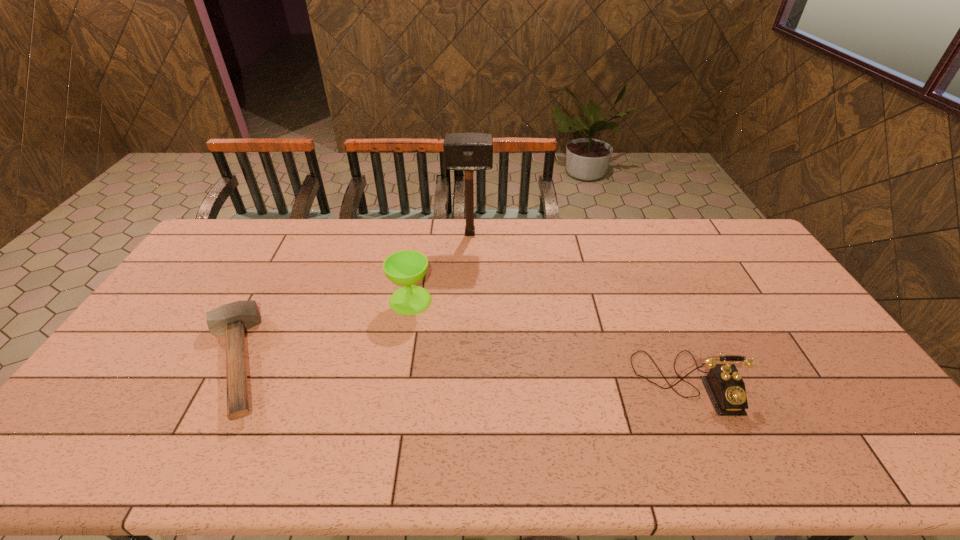
Image resolution: width=960 pixels, height=540 pixels. In order to click on the right mallet in this screenshot , I will do `click(468, 152)`.

Find the location of a particular element. The width and height of the screenshot is (960, 540). the second object from right to left is located at coordinates (468, 152).

Where is `the third shortest object`? This screenshot has width=960, height=540. the third shortest object is located at coordinates (405, 268).

Find the location of `wineglass`. wineglass is located at coordinates (405, 268).

Where is `the rightmost object`? Image resolution: width=960 pixels, height=540 pixels. the rightmost object is located at coordinates (725, 386).

Identify the location of the second shortest object. The height and width of the screenshot is (540, 960). (725, 386).

Image resolution: width=960 pixels, height=540 pixels. Identify the location of the leftmost object. (232, 319).

Locate an element on the screen. This screenshot has height=540, width=960. the shortest object is located at coordinates (232, 319).

This screenshot has width=960, height=540. Find the location of `vacant space located on the left of the farther mallet`. vacant space located on the left of the farther mallet is located at coordinates (395, 233).

I want to click on free space located on the back of the wineglass, so click(420, 245).